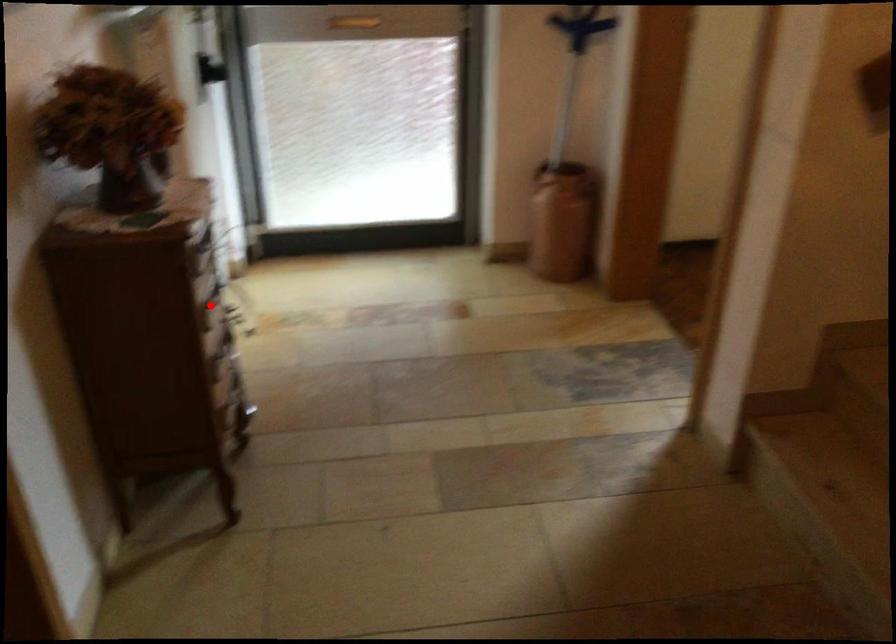
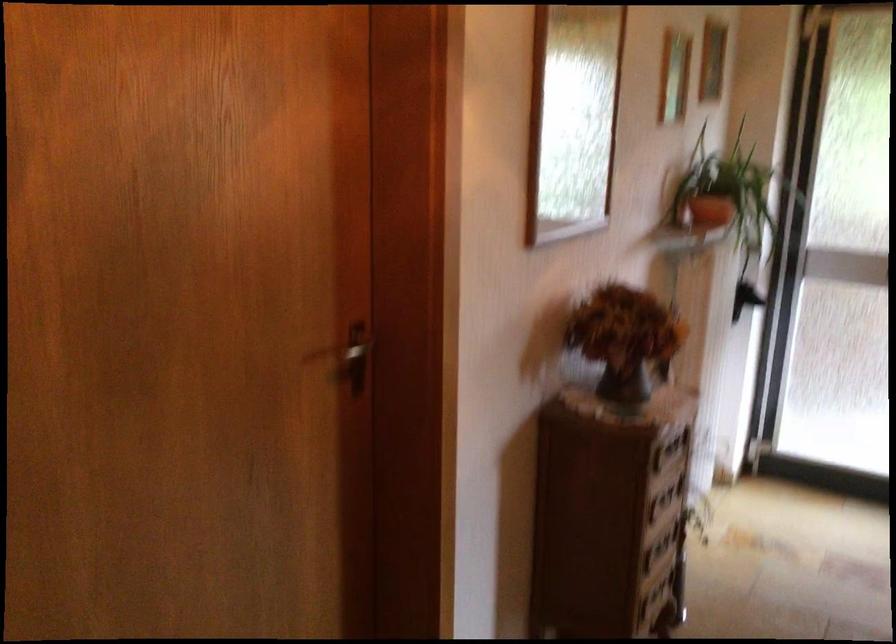
Locate, in the second image, the point that corresponds to the highlighted location in the first image.

(659, 504)